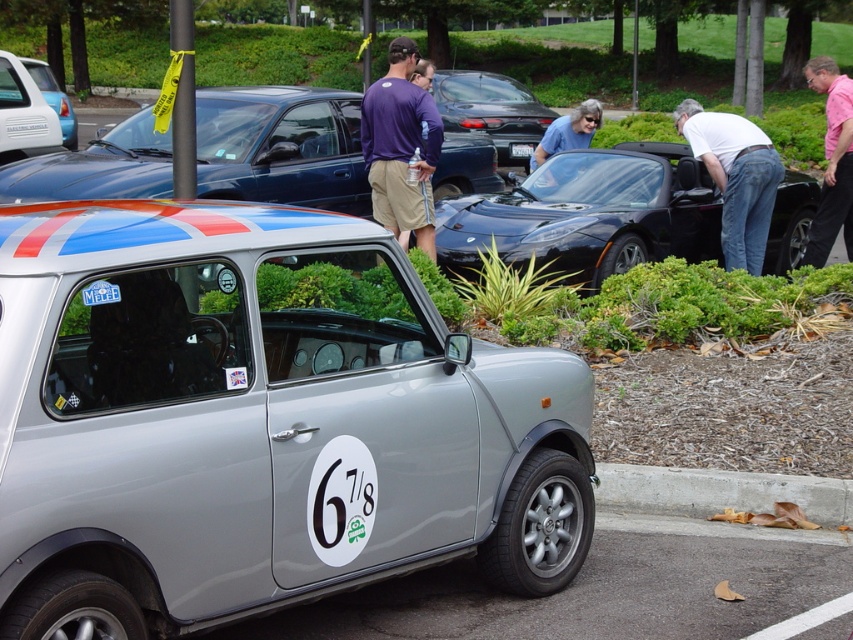
You are standing at the point marked by the coordinates point (282, 147) in the image. What is the nearest car to you?

The point (282, 147) marks the shiny blue car at center, so the nearest car to you is the shiny blue car at center.

You are a photographer at the car show and want to capture both the matte purple shirt at center and the pink shirt at upper right in a single shot. Which shirt should you focus on first to ensure both are in frame?

You should focus on the matte purple shirt at center first since it is in front of the pink shirt at upper right, ensuring both will be captured in the frame.